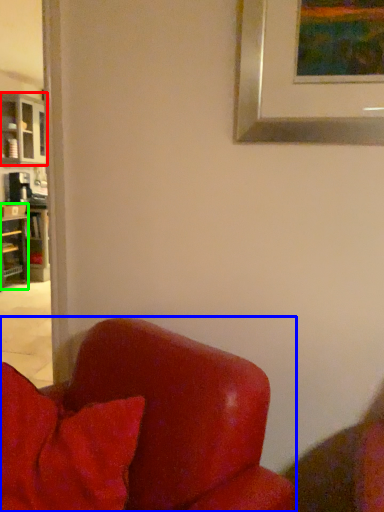
Question: Based on their relative distances, which object is nearer to cabinetry (highlighted by a red box)? Choose from chair (highlighted by a blue box) and shelf (highlighted by a green box).

Choices:
 (A) chair
 (B) shelf

Answer: (B)